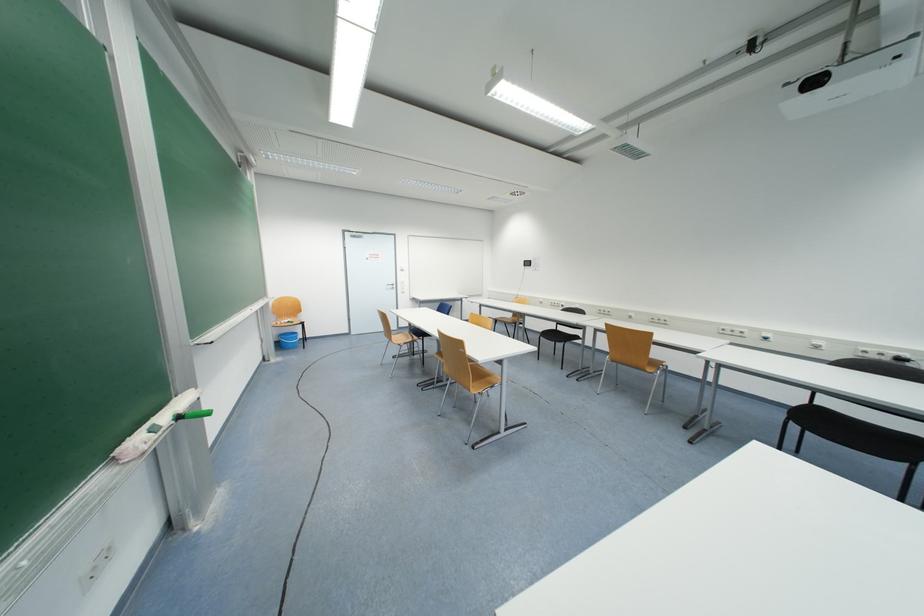
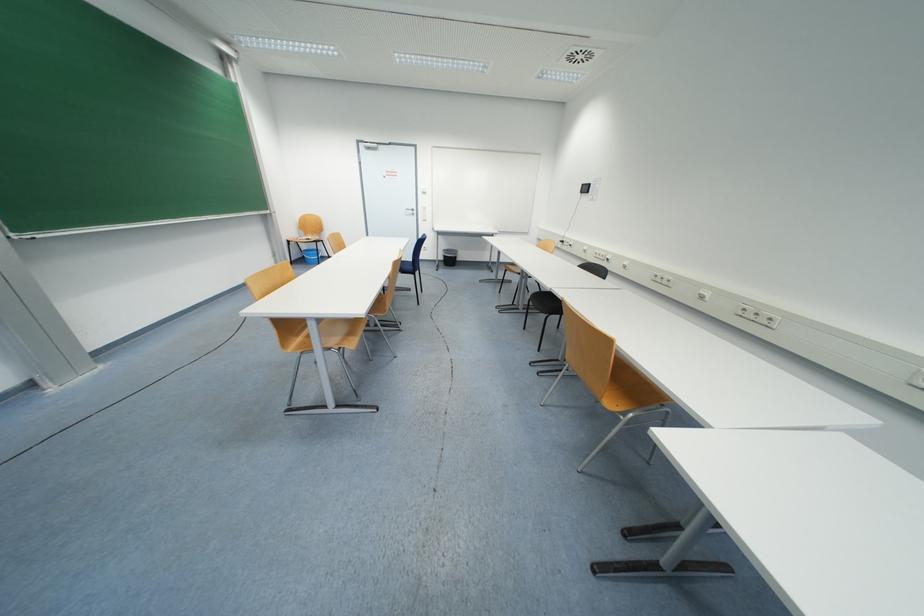
What movement of the cameraman would produce the second image?

The cameraman walked toward right, forward.